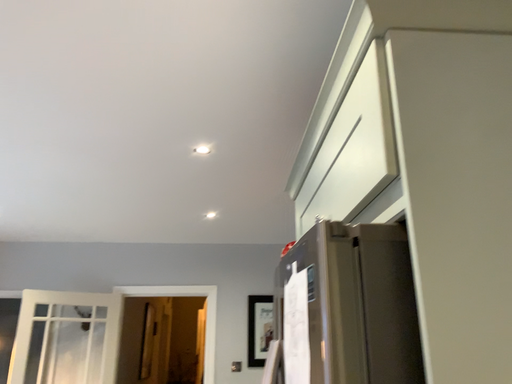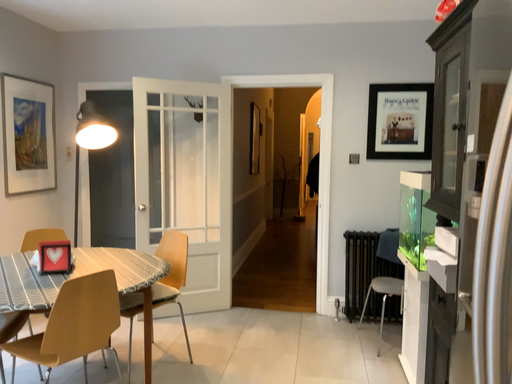
Question: Which way did the camera rotate in the video?

Choices:
 (A) rotated downward
 (B) rotated upward

Answer: (A)